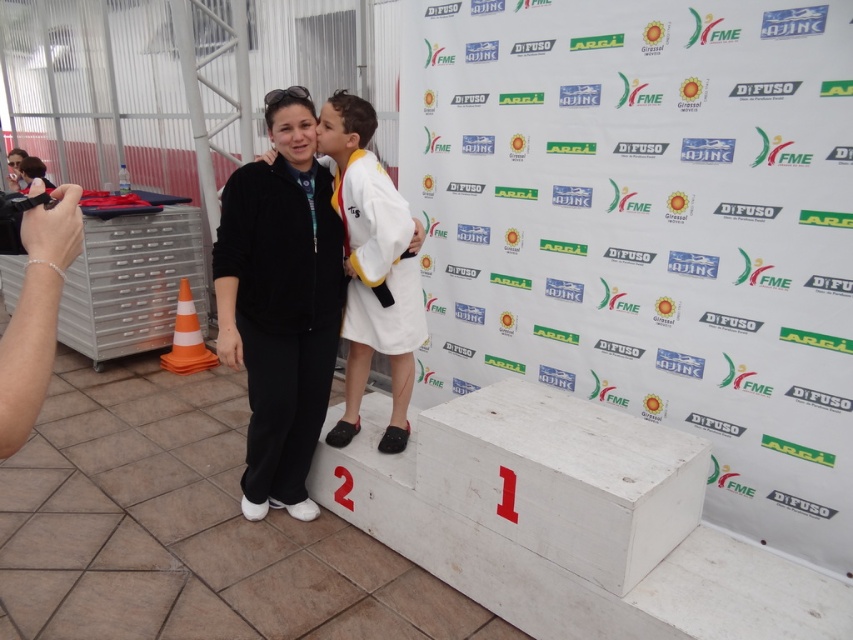
You are a photographer trying to capture the perfect shot of the two individuals on the podium. You notice two specific points in the scene at coordinates point (277, 285) and point (387, 353). Which of these points is nearer to your camera lens?

Point (277, 285) is closer to the viewer than point (387, 353), so the point at coordinates point (277, 285) is nearer to your camera lens.

You are a photographer at the judo competition and need to capture a closeup of both the black matte jacket at center and the white cotton kimono at center. Since your camera can only focus on one object at a time, which object should you adjust the focus to first if you want to ensure the closest subject is sharp?

The black matte jacket at center is to the left of the white cotton kimono at center, so the black matte jacket at center is closer to the photographer. Therefore, you should focus on the black matte jacket at center first to ensure the closest subject is sharp.

Looking at this image, what is the object located at the coordinates point (x=280, y=301)?

The object located at point (x=280, y=301) is the black matte jacket at center.